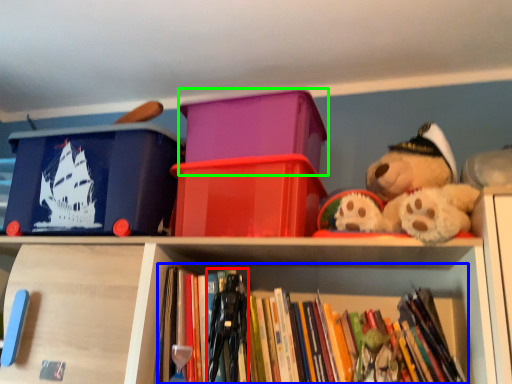
Question: Estimate the real-world distances between objects in this image. Which object is closer to toy (highlighted by a red box), book (highlighted by a blue box) or storage box (highlighted by a green box)?

Choices:
 (A) book
 (B) storage box

Answer: (A)